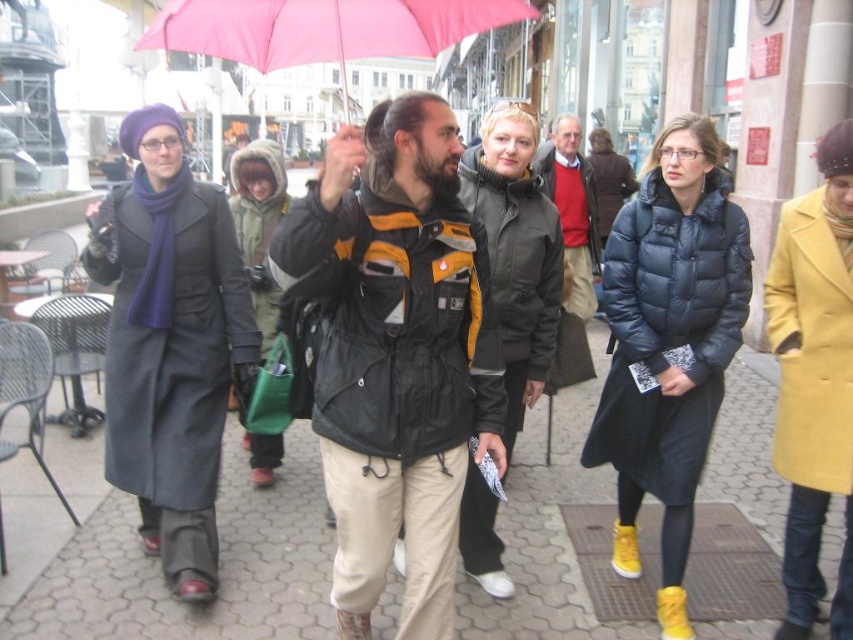
Question: Can you confirm if matte blue puffer jacket at center is bigger than pink fabric umbrella at upper center?

Choices:
 (A) yes
 (B) no

Answer: (B)

Question: Is dark gray wool coat at left above pink fabric umbrella at upper center?

Choices:
 (A) yes
 (B) no

Answer: (B)

Question: Does brown cobblestone pavement at center appear over red sweater at center?

Choices:
 (A) no
 (B) yes

Answer: (A)

Question: Which is farther from the brown cobblestone pavement at center?

Choices:
 (A) matte blue puffer jacket at center
 (B) pink fabric umbrella at upper center
 (C) black leather jacket at center

Answer: (B)

Question: Among these objects, which one is farthest from the camera?

Choices:
 (A) pink fabric umbrella at upper center
 (B) red sweater at center

Answer: (B)

Question: Among these objects, which one is farthest from the camera?

Choices:
 (A) yellow wool coat at right
 (B) black leather jacket at center
 (C) pink fabric umbrella at upper center
 (D) brown cobblestone pavement at center

Answer: (D)